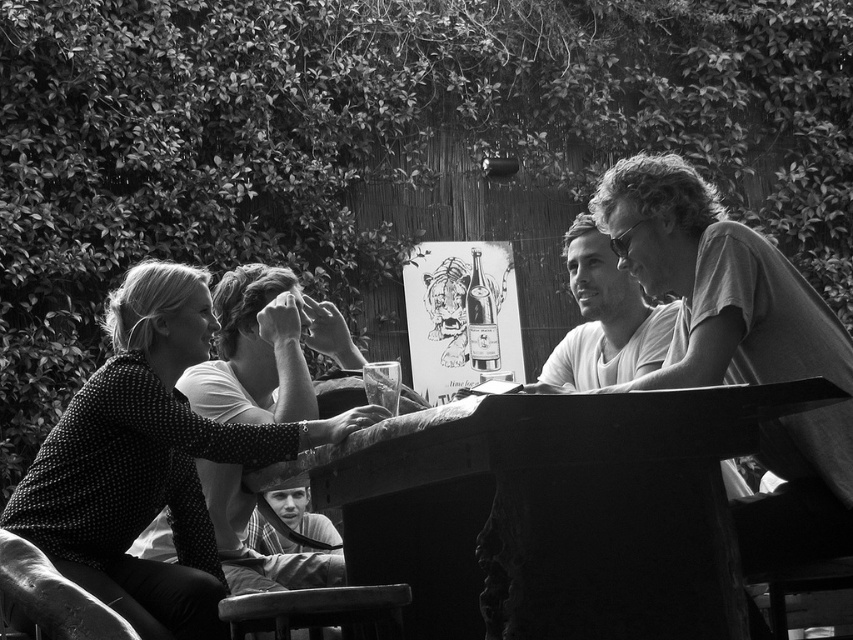
You are a photographer setting up a tripod to capture the group around the wooden table. You need to ensure that both the smooth gray shirt at right and the smooth fabric cap at lower center are fully visible in the frame. Based on their heights, which object should you adjust your camera angle to prioritize focusing on first?

The smooth gray shirt at right is much taller than the smooth fabric cap at lower center, so you should prioritize focusing on the smooth gray shirt at right first to ensure it is fully visible in the frame.